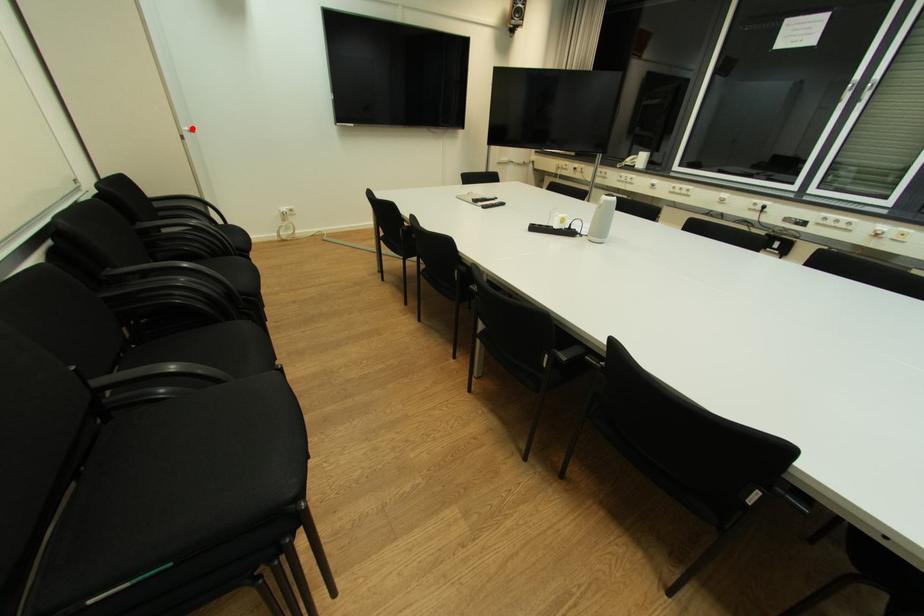
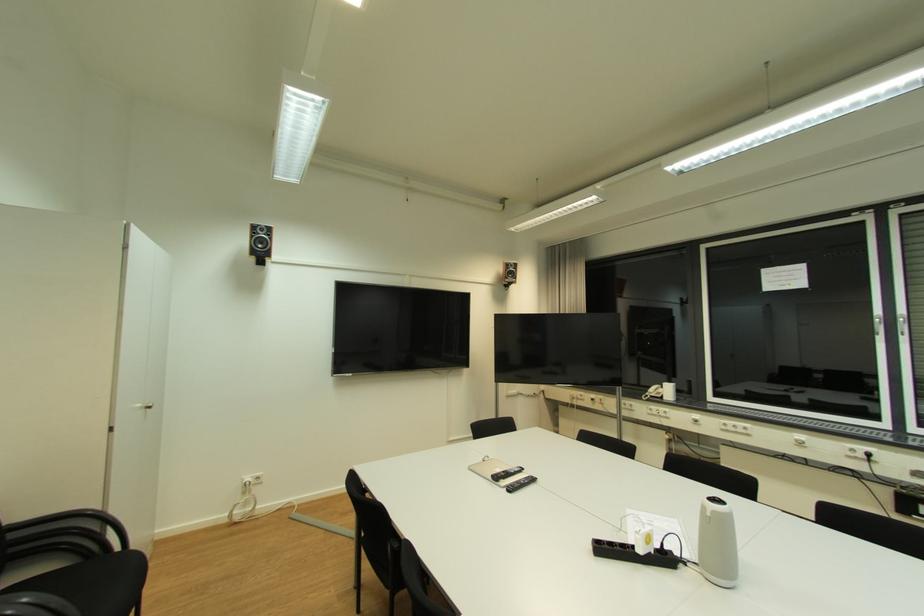
Locate, in the second image, the point that corresponds to the highlighted location in the first image.

(146, 407)